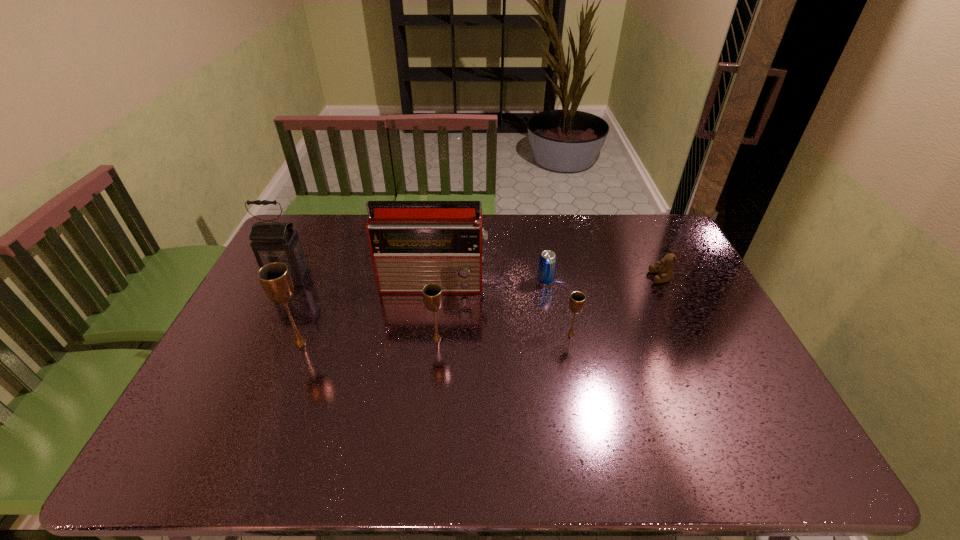
Observe the arrangement of all chalices in the image. To keep them evenly spaced, where would you place another chalice on the right? Please locate a free space. Please provide its 2D coordinates. Your answer should be formatted as a tuple, i.e. [(x, y)], where the tuple contains the x and y coordinates of a point satisfying the conditions above.

[(703, 331)]